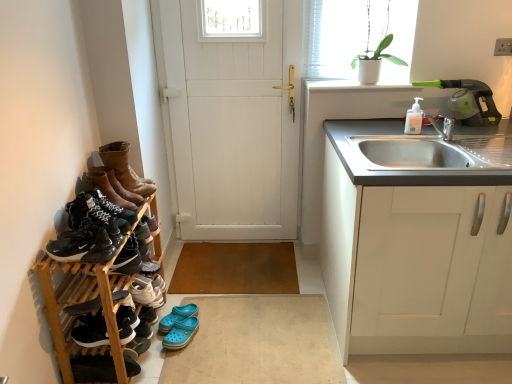
Locate an element on the screen. The image size is (512, 384). free space below blue rubber clogs at lower center (from a real-world perspective) is located at coordinates (257, 331).